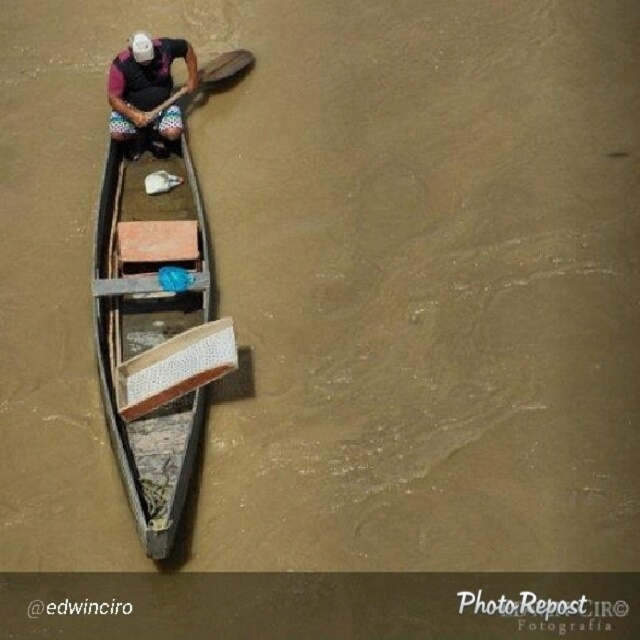
Question: Does wooden canoe at center appear on the right side of wooden paddle at center?

Choices:
 (A) yes
 (B) no

Answer: (B)

Question: Which object is the farthest from the wooden canoe at center?

Choices:
 (A) wooden paddle at center
 (B) white matte helmet at upper center

Answer: (A)

Question: Based on their relative distances, which object is farther from the white matte helmet at upper center?

Choices:
 (A) wooden canoe at center
 (B) wooden paddle at center

Answer: (B)

Question: Can you confirm if wooden canoe at center is positioned to the right of wooden paddle at center?

Choices:
 (A) no
 (B) yes

Answer: (A)

Question: Among these objects, which one is farthest from the camera?

Choices:
 (A) wooden canoe at center
 (B) white matte helmet at upper center
 (C) wooden paddle at center

Answer: (C)

Question: Is wooden canoe at center to the left of wooden paddle at center from the viewer's perspective?

Choices:
 (A) yes
 (B) no

Answer: (A)